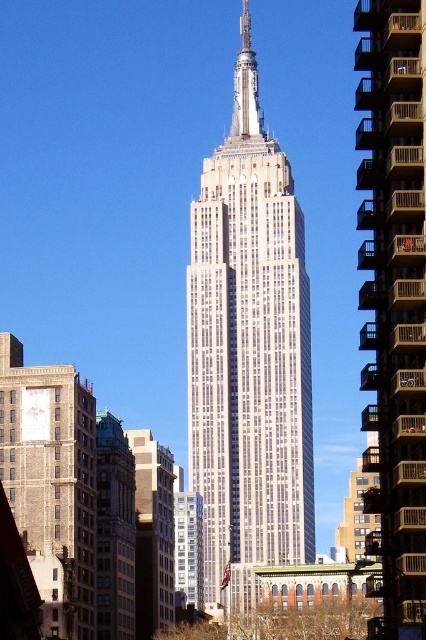
Question: Does brown concrete building at right have a smaller size compared to green patina copper tower at left?

Choices:
 (A) no
 (B) yes

Answer: (A)

Question: Considering the relative positions of white stone building at center and gray stone building at center in the image provided, where is white stone building at center located with respect to gray stone building at center?

Choices:
 (A) below
 (B) above

Answer: (B)

Question: Estimate the real-world distances between objects in this image. Which object is farther from the gray stone building at center?

Choices:
 (A) brown concrete building at right
 (B) brick wall clock at lower left
 (C) white stone building at center

Answer: (C)

Question: Does brown concrete building at right have a greater width compared to brick wall clock at lower left?

Choices:
 (A) no
 (B) yes

Answer: (A)

Question: Estimate the real-world distances between objects in this image. Which object is closer to the white stone building at center?

Choices:
 (A) green patina copper tower at left
 (B) brick wall clock at lower left
 (C) brown concrete building at right
 (D) gray stone building at center

Answer: (D)

Question: Which point is closer to the camera?

Choices:
 (A) (146, 609)
 (B) (72, 464)

Answer: (B)